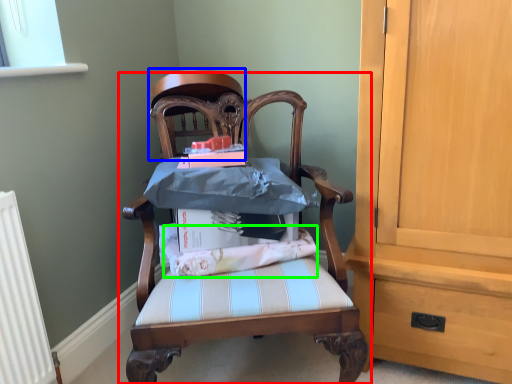
Question: Considering the real-world distances, which object is farthest from chair (highlighted by a red box)? chair (highlighted by a blue box) or fabric (highlighted by a green box)?

Choices:
 (A) chair
 (B) fabric

Answer: (A)